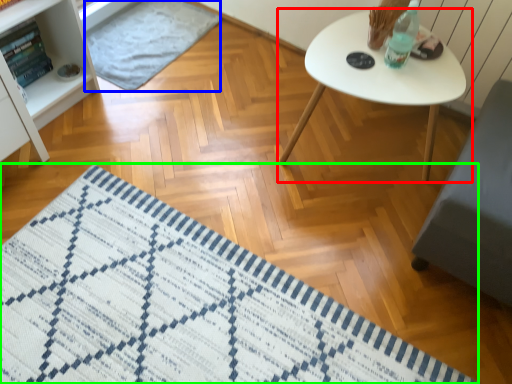
Question: Which is farther away from table (highlighted by a red box)? mat (highlighted by a blue box) or mat (highlighted by a green box)?

Choices:
 (A) mat
 (B) mat

Answer: (A)